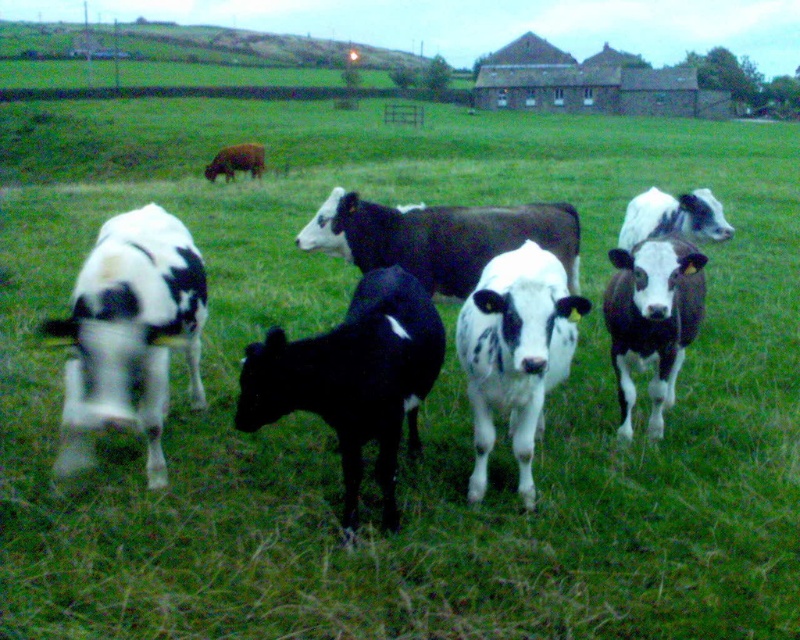
You are a farmer checking the herd. You notice the black and white cows at center and the black smooth calf at center. Which group is closer to you?

The black and white cows at center are closer to you because they are positioned in front of the black smooth calf at center.

You are standing at the origin point of the coordinate system. You want to move towards the black and white cows at center. Which direction should you move in?

The black and white cows at center are located at coordinate point 0.489 on the x axis and 0.631 on the y axis. Since you are at the origin point, you should move towards the positive x and positive y direction to reach them.

You are a farmer checking the pasture. You see the black and white cows at center and the black smooth calf at center. Which one is wider?

The black and white cows at center are wider than the black smooth calf at center.